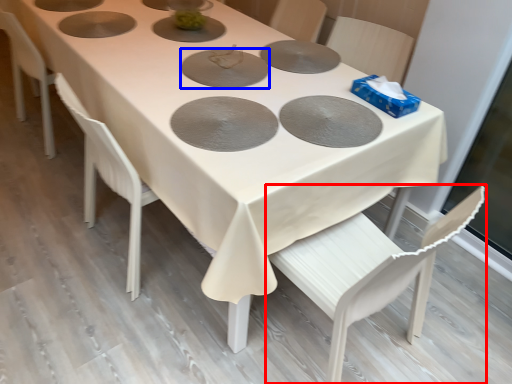
Question: Among these objects, which one is nearest to the camera, chair (highlighted by a red box) or pizza pan (highlighted by a blue box)?

Choices:
 (A) chair
 (B) pizza pan

Answer: (A)